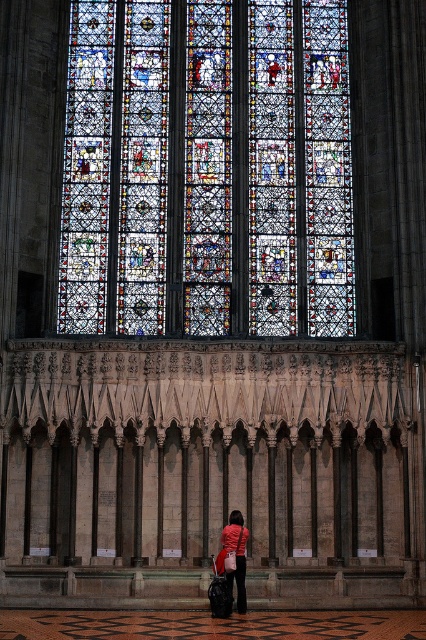
Question: Does multicolored stained glass at center have a smaller size compared to matte red jacket at center?

Choices:
 (A) no
 (B) yes

Answer: (A)

Question: In this image, where is multicolored stained glass at center located relative to matte red jacket at center?

Choices:
 (A) left
 (B) right

Answer: (A)

Question: Is multicolored stained glass at center behind matte red jacket at center?

Choices:
 (A) no
 (B) yes

Answer: (B)

Question: Among these objects, which one is farthest from the camera?

Choices:
 (A) matte red jacket at center
 (B) multicolored stained glass at center

Answer: (B)